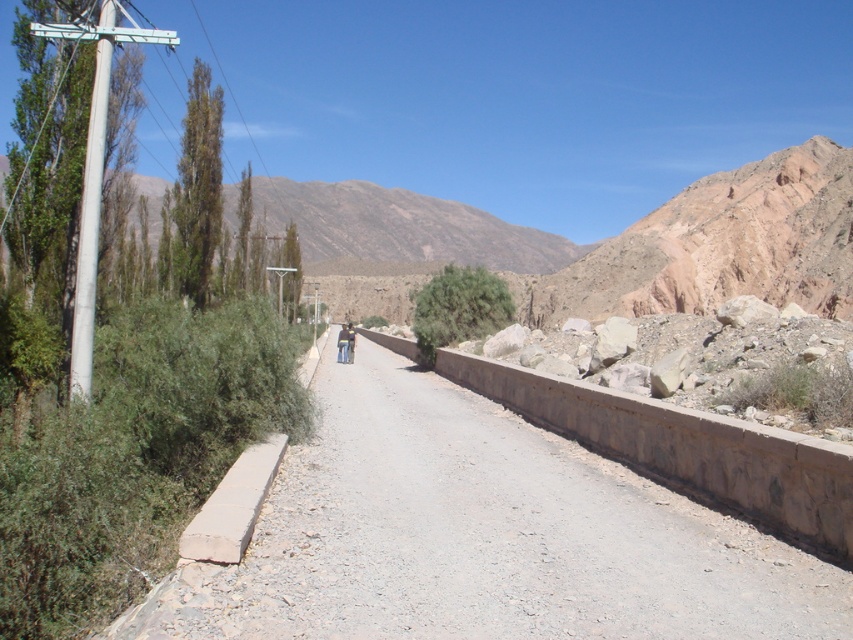
You are standing at the starting point of the road in the rural scene. You notice a white metallic pole at left. Can you tell me the exact coordinates of this pole?

The white metallic pole at left is located at coordinates point (91,211).

You are a traveler standing on the rural road and see a brown leather jacket at center and dark blue jeans at center. Which item is shorter in height?

The brown leather jacket at center is not as tall as the dark blue jeans at center, so the brown leather jacket at center is shorter in height.